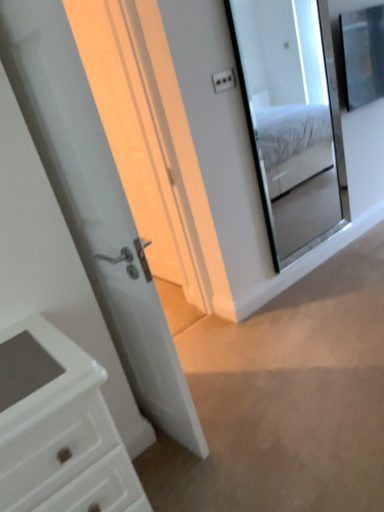
What do you see at coordinates (223, 80) in the screenshot? I see `white plastic light switch at upper center` at bounding box center [223, 80].

Locate an element on the screen. This screenshot has width=384, height=512. clear glass mirror at upper right is located at coordinates (291, 118).

Which object is further away from the camera, white glossy door at center or white glossy door at center?

white glossy door at center.

Is white glossy door at center not near white glossy door at center?

Yes, white glossy door at center and white glossy door at center are quite far apart.

Which of these two, white glossy door at center or white glossy door at center, stands taller?

white glossy door at center is taller.

From the image's perspective, which one is positioned lower, white glossy door at center or white glossy door at center?

white glossy door at center.

Is white glossy door at center not inside white plastic light switch at upper center?

white glossy door at center is positioned outside white plastic light switch at upper center.

Considering the relative positions of white glossy door at center and white plastic light switch at upper center in the image provided, is white glossy door at center behind white plastic light switch at upper center?

No.

From the picture: Is white glossy door at center bigger than white plastic light switch at upper center?

Correct, white glossy door at center is larger in size than white plastic light switch at upper center.

From the picture: Who is shorter, white glossy door at center or white plastic light switch at upper center?

With less height is white plastic light switch at upper center.

What's the angular difference between clear glass mirror at upper right and white glossy door at center's facing directions?

The angle between the facing direction of clear glass mirror at upper right and the facing direction of white glossy door at center is 92.7 degrees.

Does clear glass mirror at upper right have a larger size compared to white glossy door at center?

Correct, clear glass mirror at upper right is larger in size than white glossy door at center.

Where is `screen door in front of the clear glass mirror at upper right`? screen door in front of the clear glass mirror at upper right is located at coordinates (139, 137).

Is white plastic light switch at upper center not within white glossy door at center?

Yes, white plastic light switch at upper center is not within white glossy door at center.

Between white plastic light switch at upper center and white glossy door at center, which one has smaller size?

Smaller between the two is white plastic light switch at upper center.

You are a GUI agent. You are given a task and a screenshot of the screen. Output one action in this format:
    pyautogui.click(x=<x>, y=<y>)
    Task: Click on the door that appears below the white plastic light switch at upper center (from the image's perspective)
    
    Given the screenshot: What is the action you would take?
    pyautogui.click(x=96, y=207)

Looking at their sizes, would you say clear glass mirror at upper right is wider or thinner than white plastic light switch at upper center?

Clearly, clear glass mirror at upper right has more width compared to white plastic light switch at upper center.

Is point (321, 152) closer or farther from the camera than point (228, 70)?

Point (321, 152) is farther from the camera than point (228, 70).

From the image's perspective, is clear glass mirror at upper right positioned above or below white plastic light switch at upper center?

Based on their image positions, clear glass mirror at upper right is located beneath white plastic light switch at upper center.

Looking at this image, considering the sizes of objects clear glass mirror at upper right and white plastic light switch at upper center in the image provided, who is shorter, clear glass mirror at upper right or white plastic light switch at upper center?

Standing shorter between the two is white plastic light switch at upper center.

Would you say white glossy door at center is to the left or to the right of clear glass mirror at upper right in the picture?

white glossy door at center is positioned on clear glass mirror at upper right's left side.

How many degrees apart are the facing directions of white glossy door at center and clear glass mirror at upper right?

white glossy door at center and clear glass mirror at upper right are facing 93.6 degrees away from each other.

From the image's perspective, is white glossy door at center on clear glass mirror at upper right?

No, from the image's perspective, white glossy door at center is not on top of clear glass mirror at upper right.

In the image, there is a clear glass mirror at upper right. Identify the location of door below it (from the image's perspective). The height and width of the screenshot is (512, 384). (96, 207).

Looking at the image, does white glossy door at center seem bigger or smaller compared to white plastic light switch at upper center?

In the image, white glossy door at center appears to be larger than white plastic light switch at upper center.

Is white glossy door at center touching white plastic light switch at upper center?

No, white glossy door at center is not making contact with white plastic light switch at upper center.

Is white glossy door at center not within white plastic light switch at upper center?

Absolutely, white glossy door at center is external to white plastic light switch at upper center.

In the image, there is a white glossy door at center. Find the location of `door below it (from the image's perspective)`. door below it (from the image's perspective) is located at coordinates click(96, 207).

Find the location of a particular element. The width and height of the screenshot is (384, 512). light switch above the white glossy door at center (from the image's perspective) is located at coordinates (223, 80).

Estimate the real-world distances between objects in this image. Which object is further from white glossy door at center, white glossy door at center or clear glass mirror at upper right?

clear glass mirror at upper right.

Looking at the image, which one is located closer to clear glass mirror at upper right, white plastic light switch at upper center or white glossy door at center?

The object closer to clear glass mirror at upper right is white plastic light switch at upper center.

Based on their spatial positions, is white glossy door at center or white glossy door at center closer to clear glass mirror at upper right?

white glossy door at center is closer to clear glass mirror at upper right.

Which object lies further to the anchor point white plastic light switch at upper center, white glossy door at center or white glossy door at center?

The object further to white plastic light switch at upper center is white glossy door at center.

Based on their spatial positions, is white glossy door at center or white plastic light switch at upper center further from white glossy door at center?

Based on the image, white glossy door at center appears to be further to white glossy door at center.

Which object lies nearer to the anchor point white glossy door at center, clear glass mirror at upper right or white plastic light switch at upper center?

white plastic light switch at upper center lies closer to white glossy door at center than the other object.

Considering their positions, is white plastic light switch at upper center positioned closer to white glossy door at center than clear glass mirror at upper right?

Among the two, white plastic light switch at upper center is located nearer to white glossy door at center.

From the image, which object appears to be farther from white plastic light switch at upper center, clear glass mirror at upper right or white glossy door at center?

clear glass mirror at upper right is further to white plastic light switch at upper center.

Where is `light switch between white glossy door at center and clear glass mirror at upper right from left to right`? This screenshot has width=384, height=512. light switch between white glossy door at center and clear glass mirror at upper right from left to right is located at coordinates (223, 80).

You are a GUI agent. You are given a task and a screenshot of the screen. Output one action in this format:
    pyautogui.click(x=<x>, y=<y>)
    Task: Click on the screen door between white glossy door at center and white plastic light switch at upper center along the z-axis
    
    Given the screenshot: What is the action you would take?
    pyautogui.click(x=139, y=137)

You are a GUI agent. You are given a task and a screenshot of the screen. Output one action in this format:
    pyautogui.click(x=<x>, y=<y>)
    Task: Click on the screen door located between white glossy door at center and clear glass mirror at upper right in the depth direction
    This screenshot has width=384, height=512.
    Given the screenshot: What is the action you would take?
    pyautogui.click(x=139, y=137)

Image resolution: width=384 pixels, height=512 pixels. Find the location of `mirror between white glossy door at center and white plastic light switch at upper center along the z-axis`. mirror between white glossy door at center and white plastic light switch at upper center along the z-axis is located at coordinates (291, 118).